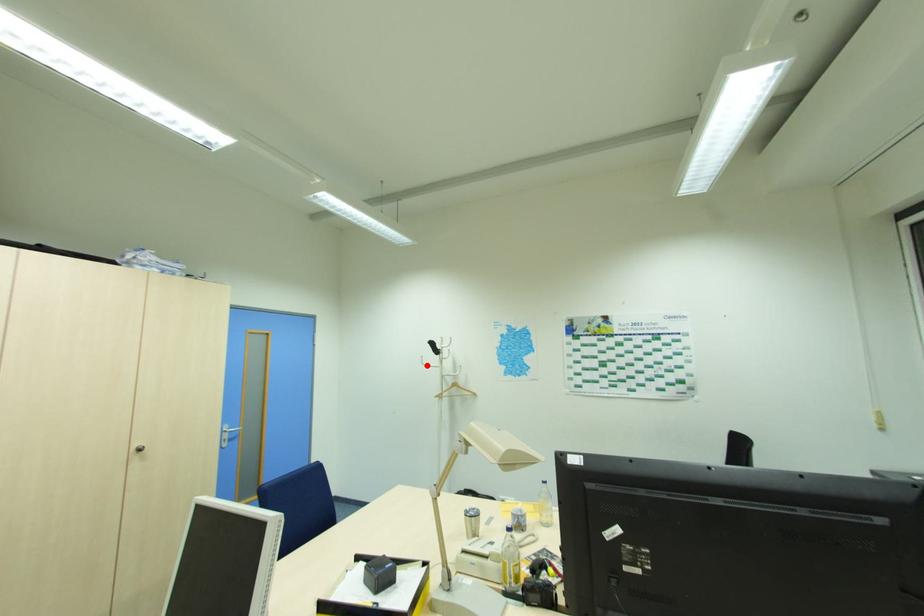
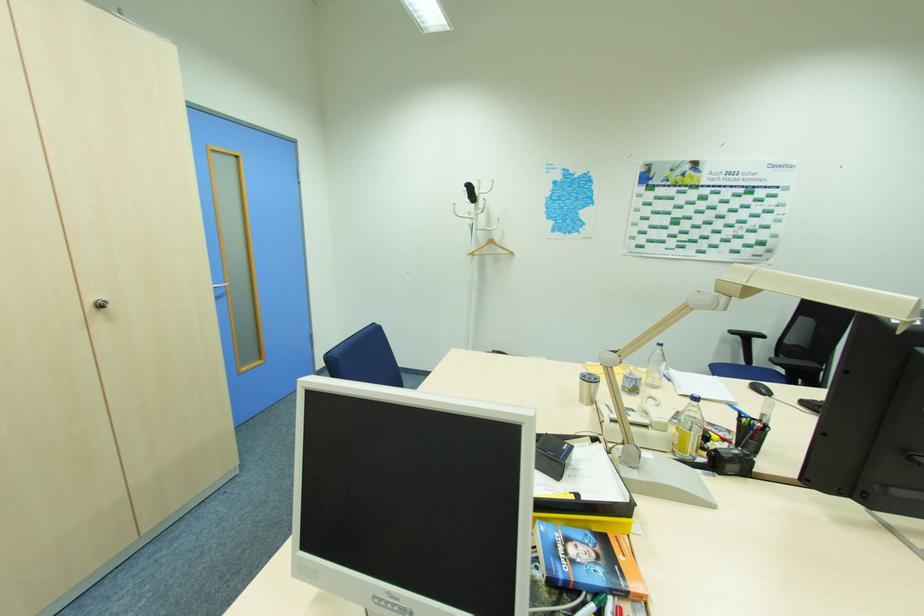
Question: I am providing you with two images of the same scene from different viewpoints. A red point is shown in image1. For the corresponding object point in image2, is it positioned nearer or farther from the camera?

Choices:
 (A) Nearer
 (B) Farther

Answer: (A)